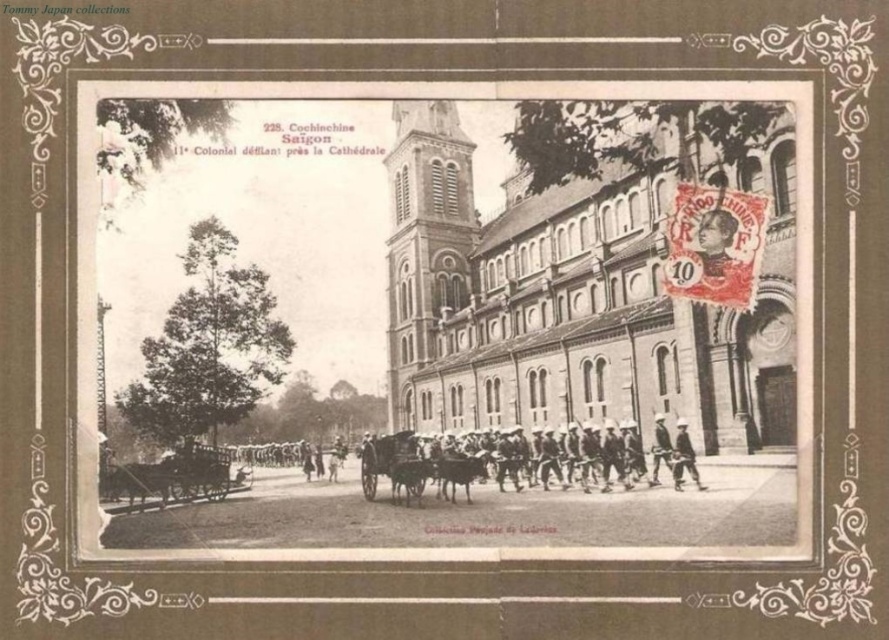
Question: Is stone church at center in front of white matte helmet at center?

Choices:
 (A) no
 (B) yes

Answer: (B)

Question: Does light brown leather hat at lower right appear over white matte helmet at center?

Choices:
 (A) no
 (B) yes

Answer: (A)

Question: Which object appears farthest from the camera in this image?

Choices:
 (A) white matte helmet at center
 (B) smooth brown skin at upper right

Answer: (B)

Question: Which of these objects is positioned closest to the white matte helmet at center?

Choices:
 (A) light brown leather hat at lower right
 (B) smooth brown skin at upper right

Answer: (A)

Question: Which point appears closest to the camera in this image?

Choices:
 (A) (685, 442)
 (B) (654, 296)
 (C) (655, 452)

Answer: (A)

Question: Does smooth brown skin at upper right lie behind light brown leather hat at lower right?

Choices:
 (A) no
 (B) yes

Answer: (B)